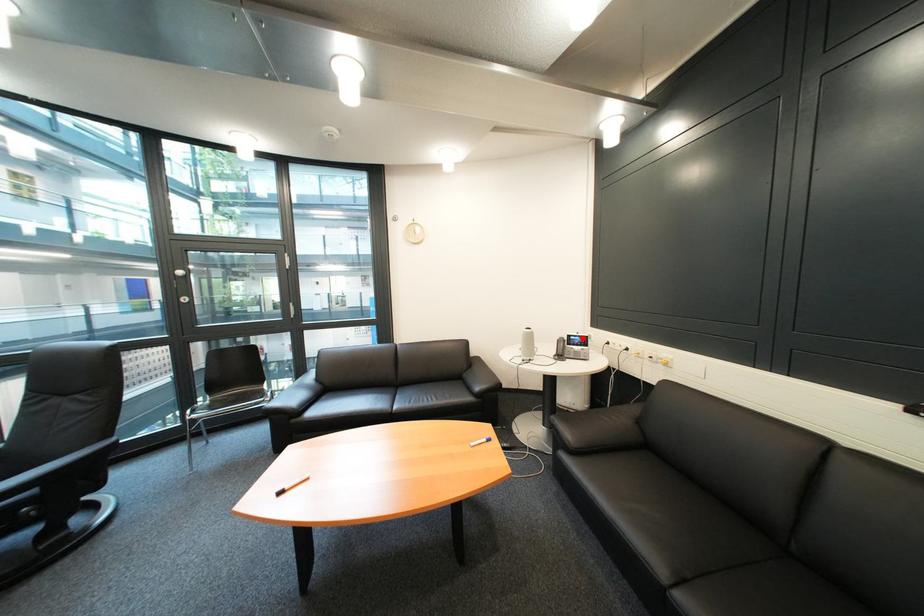
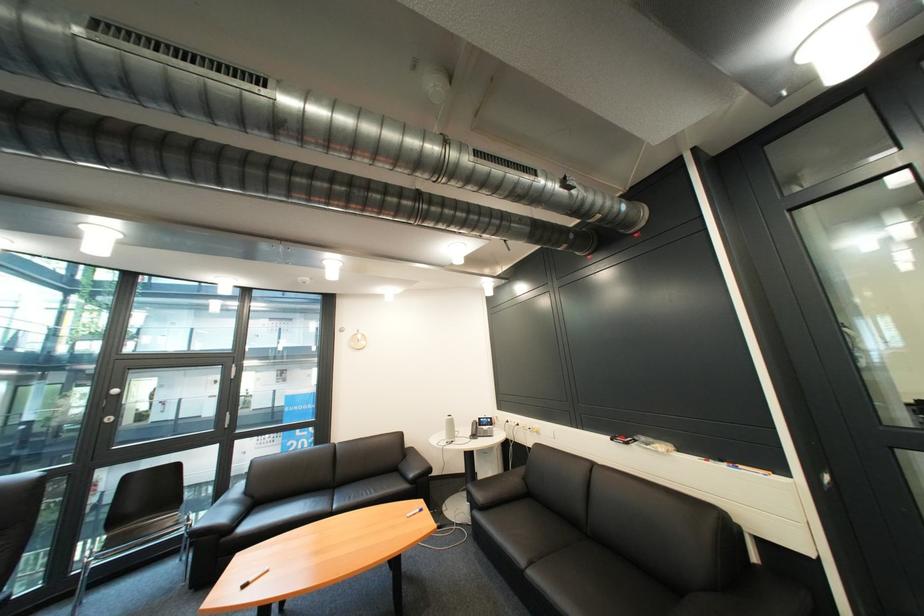
Find the pixel in the second image that matches the highlighted location in the first image.

(492, 419)